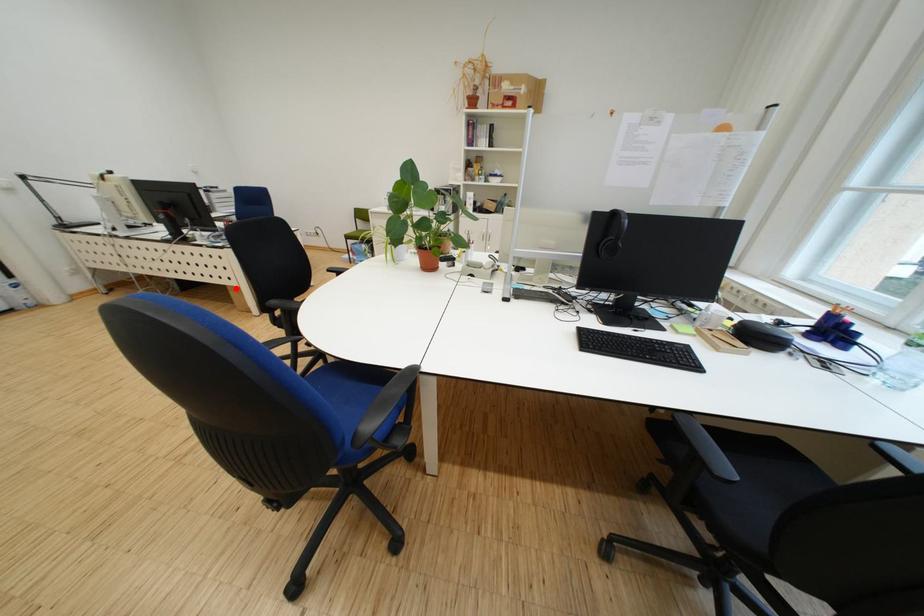
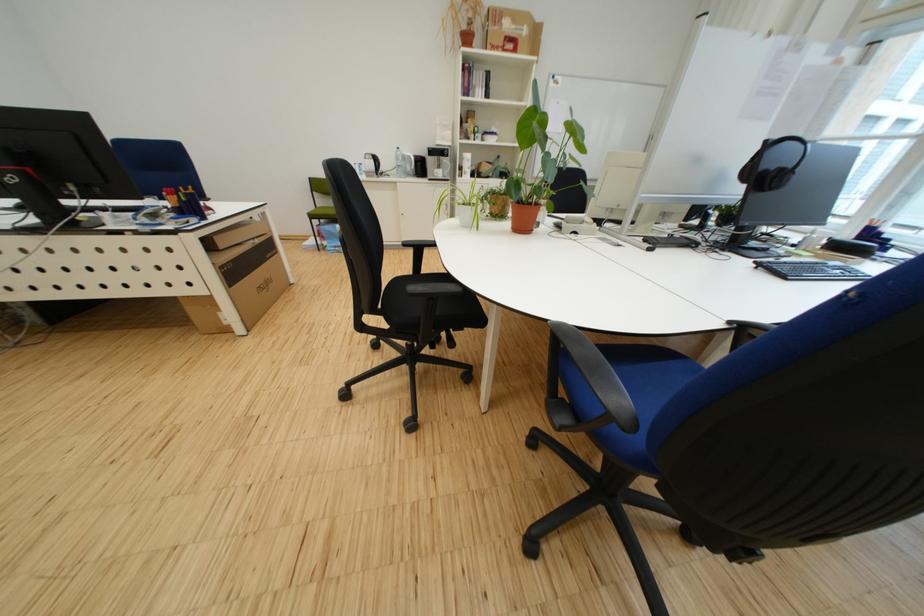
Question: I am providing you with two images of the same scene from different viewpoints. In image1, a red point is highlighted. Considering the same 3D point in image2, which of the following is correct?

Choices:
 (A) It is closer
 (B) It is farther

Answer: (A)